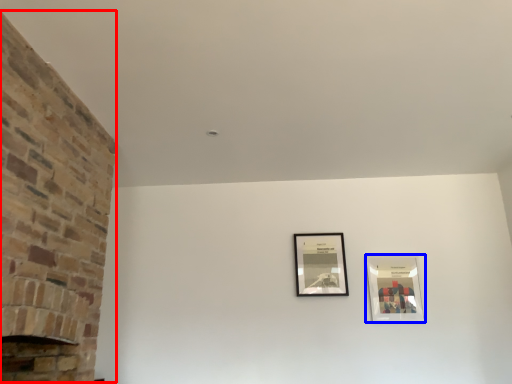
Question: Which object is further to the camera taking this photo, fireplace (highlighted by a red box) or picture frame (highlighted by a blue box)?

Choices:
 (A) fireplace
 (B) picture frame

Answer: (B)